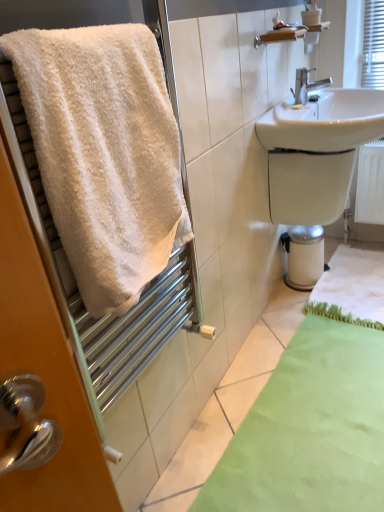
Question: Can you confirm if green fuzzy bath mat at lower right, which ranks as the 2th bath mat in front-to-back order, is shorter than white glossy bidet at lower right?

Choices:
 (A) no
 (B) yes

Answer: (B)

Question: Is green fuzzy bath mat at lower right, the 1th bath mat when ordered from back to front, not near white glossy bidet at lower right?

Choices:
 (A) yes
 (B) no

Answer: (B)

Question: Considering the relative sizes of green fuzzy bath mat at lower right, the 1th bath mat when ordered from back to front, and white glossy bidet at lower right in the image provided, is green fuzzy bath mat at lower right, the 1th bath mat when ordered from back to front, bigger than white glossy bidet at lower right?

Choices:
 (A) yes
 (B) no

Answer: (A)

Question: Considering the relative positions of green fuzzy bath mat at lower right, which ranks as the 2th bath mat in front-to-back order, and white glossy bidet at lower right in the image provided, is green fuzzy bath mat at lower right, which ranks as the 2th bath mat in front-to-back order, to the left of white glossy bidet at lower right from the viewer's perspective?

Choices:
 (A) yes
 (B) no

Answer: (B)

Question: Does green fuzzy bath mat at lower right, the 1th bath mat when ordered from back to front, have a smaller size compared to white glossy bidet at lower right?

Choices:
 (A) yes
 (B) no

Answer: (B)

Question: From the image's perspective, relative to silver metallic faucet at upper right, is white glossy sink at upper right above or below?

Choices:
 (A) above
 (B) below

Answer: (B)

Question: From a real-world perspective, is white glossy sink at upper right physically located above or below silver metallic faucet at upper right?

Choices:
 (A) above
 (B) below

Answer: (B)

Question: Is white glossy sink at upper right taller or shorter than silver metallic faucet at upper right?

Choices:
 (A) short
 (B) tall

Answer: (B)

Question: Is white glossy sink at upper right in front of or behind silver metallic faucet at upper right in the image?

Choices:
 (A) behind
 (B) front

Answer: (B)

Question: Is white glossy sink at upper right in front of or behind white fluffy towel at left in the image?

Choices:
 (A) front
 (B) behind

Answer: (B)

Question: Visually, is white glossy sink at upper right positioned to the left or to the right of white fluffy towel at left?

Choices:
 (A) right
 (B) left

Answer: (A)

Question: From the image's perspective, is white glossy sink at upper right above or below white fluffy towel at left?

Choices:
 (A) below
 (B) above

Answer: (B)

Question: Considering the positions of white glossy sink at upper right and white fluffy towel at left in the image, is white glossy sink at upper right taller or shorter than white fluffy towel at left?

Choices:
 (A) short
 (B) tall

Answer: (B)

Question: Visually, is green fuzzy bath mat at lower right, the 1th bath mat when ordered from back to front, positioned to the left or to the right of silver metallic faucet at upper right?

Choices:
 (A) right
 (B) left

Answer: (A)

Question: Is point (350, 306) closer or farther from the camera than point (294, 98)?

Choices:
 (A) farther
 (B) closer

Answer: (A)